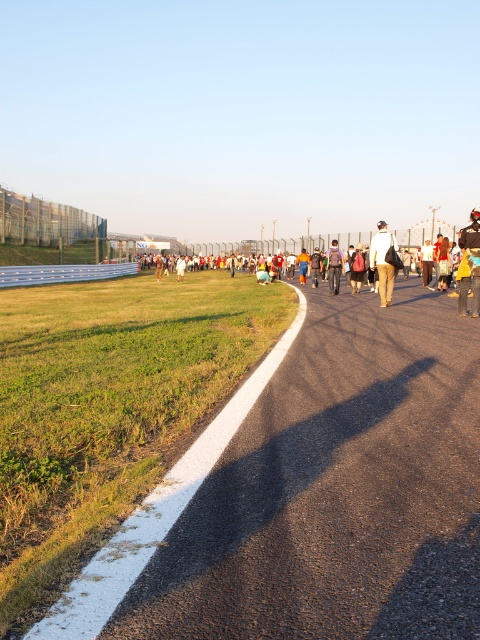
You are standing at the edge of the road and see both the white casual clothing at center and the matte black jacket at center. Which one is nearer to you?

The white casual clothing at center is closer to the viewer than the matte black jacket at center, so the white casual clothing at center is nearer to you.

From the picture: You are a photographer setting up equipment on the asphalt at center. You need to place a matte black jacket at center so that it covers exactly half of the asphalt area. Is this possible given their sizes?

The asphalt at center is larger in size than the matte black jacket at center, so placing the matte black jacket at center to cover exactly half of the asphalt at center would require the jacket to be at least half the size of the asphalt. Since the jacket is smaller than the asphalt, it can cover less than half, but not exactly half. Therefore, it is not possible to cover exactly half the asphalt area with the matte black jacket at center.

You are a pedestrian standing on the asphalt at center. You see the matte black jacket at center in front of you. Which object is closer to the ground?

The asphalt at center is closer to the ground than the matte black jacket at center since it is not as tall as the matte black jacket at center.